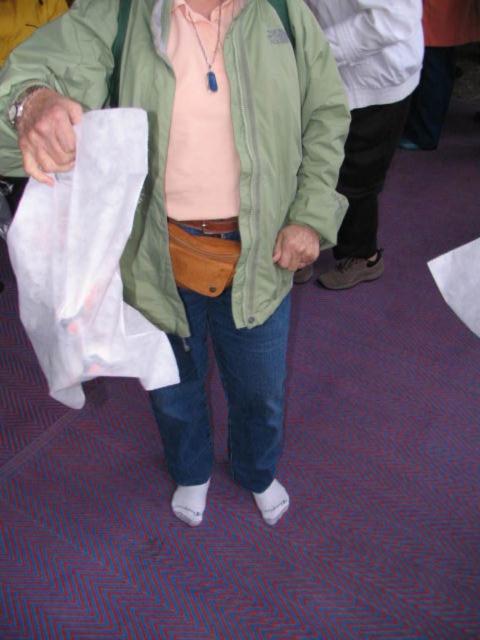
You are organizing a clothing store and need to arrange the green matte jacket at center and the leather glove at lower left on a display rack. According to the image, which item should be placed to the right side of the other?

The green matte jacket at center should be placed to the right of the leather glove at lower left as per the image.

From the picture: You are standing in a room and see two points marked on the floor. The first point is at coordinate point (294, 124) and the second is at point (35, 173). Which point is closer to you?

Point (35, 173) is closer to you because it is nearer to the viewer compared to point (294, 124).